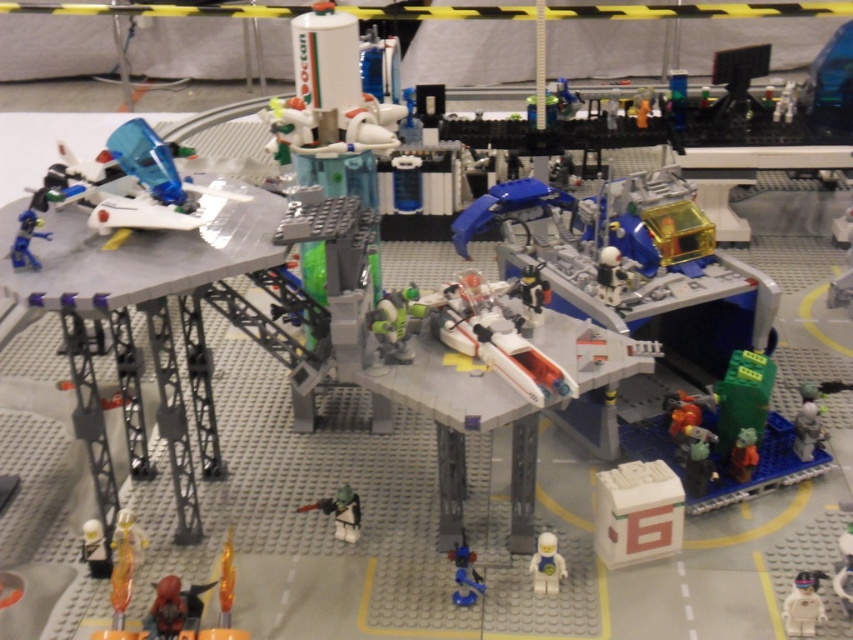
Question: Estimate the real-world distances between objects in this image. Which object is closer to the white matte astronaut at lower right?

Choices:
 (A) shiny silver figure at lower left
 (B) white matte helmet at center
 (C) shiny red helmet at lower center
 (D) green matte figure at lower right

Answer: (D)

Question: Is blue plastic figure at center to the right of shiny blue spaceship at upper left from the viewer's perspective?

Choices:
 (A) no
 (B) yes

Answer: (B)

Question: Which point appears closest to the camera in this image?

Choices:
 (A) (465, 548)
 (B) (804, 611)

Answer: (B)

Question: Can you confirm if shiny red helmet at lower center is positioned to the left of shiny silver figure at lower left?

Choices:
 (A) no
 (B) yes

Answer: (A)

Question: Which of these objects is positioned farthest from the shiny red helmet at lower center?

Choices:
 (A) white plastic astronaut at center
 (B) shiny blue spaceship at upper left
 (C) blue plastic figure at center
 (D) white matte astronaut at lower right

Answer: (D)

Question: Is white matte astronaut at lower right above shiny blue spaceship at upper left?

Choices:
 (A) yes
 (B) no

Answer: (B)